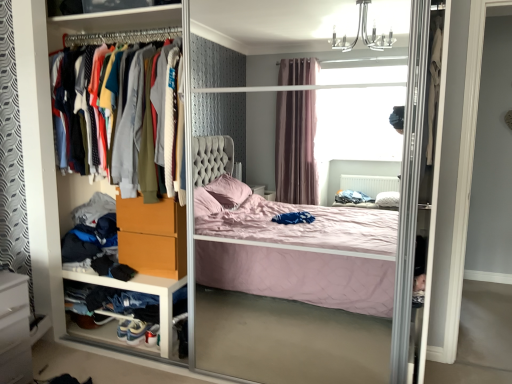
Image resolution: width=512 pixels, height=384 pixels. Identify the location of free space on the front side of white suede sneaker at lower left, placed as the 1th shoe when sorted from left to right. (114, 354).